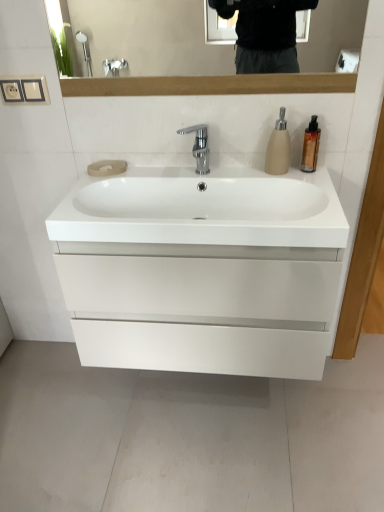
What do you see at coordinates (311, 146) in the screenshot? This screenshot has width=384, height=512. I see `gold metallic soap dispenser at upper right, which is the first soap dispenser from right to left` at bounding box center [311, 146].

This screenshot has height=512, width=384. Find the location of `white glossy sink at center`. white glossy sink at center is located at coordinates (202, 214).

This screenshot has width=384, height=512. What do you see at coordinates (202, 214) in the screenshot? I see `white glossy sink at center` at bounding box center [202, 214].

In the scene shown: What is the approximate height of white glossy cabinet at center?

20.25 inches.

Identify the location of gold metallic soap dispenser at upper right, which appears as the 2th soap dispenser when viewed from the left. This screenshot has width=384, height=512. (311, 146).

At what (x,y) coordinates should I click in order to perform the action: click on soap dispenser located behind the matte beige soap dispenser at upper right, arranged as the second soap dispenser when viewed from the right. Please return your answer as a coordinate pair (x, y). The height and width of the screenshot is (512, 384). Looking at the image, I should click on (311, 146).

Considering the positions of objects matte beige soap dispenser at upper right, arranged as the second soap dispenser when viewed from the right, and gold metallic soap dispenser at upper right, which appears as the 2th soap dispenser when viewed from the left, in the image provided, who is in front, matte beige soap dispenser at upper right, arranged as the second soap dispenser when viewed from the right, or gold metallic soap dispenser at upper right, which appears as the 2th soap dispenser when viewed from the left,?

Positioned in front is matte beige soap dispenser at upper right, arranged as the second soap dispenser when viewed from the right.

Which object is positioned more to the left, matte beige soap dispenser at upper right, arranged as the second soap dispenser when viewed from the right, or gold metallic soap dispenser at upper right, which is the first soap dispenser from right to left?

From the viewer's perspective, matte beige soap dispenser at upper right, arranged as the second soap dispenser when viewed from the right, appears more on the left side.

Is the surface of matte beige soap dispenser at upper right, arranged as the second soap dispenser when viewed from the right, in direct contact with gold metallic soap dispenser at upper right, which appears as the 2th soap dispenser when viewed from the left?

Yes, matte beige soap dispenser at upper right, arranged as the second soap dispenser when viewed from the right, is beside gold metallic soap dispenser at upper right, which appears as the 2th soap dispenser when viewed from the left.

Is point (316, 159) closer to camera compared to point (148, 356)?

Yes, point (316, 159) is closer to viewer.

Where is `the 2nd soap dispenser to the right when counting from the white glossy cabinet at center`? the 2nd soap dispenser to the right when counting from the white glossy cabinet at center is located at coordinates click(311, 146).

Who is taller, gold metallic soap dispenser at upper right, which appears as the 2th soap dispenser when viewed from the left, or white glossy cabinet at center?

With more height is white glossy cabinet at center.

Consider the image. Considering the relative positions of gold metallic soap dispenser at upper right, which appears as the 2th soap dispenser when viewed from the left, and white glossy cabinet at center in the image provided, is gold metallic soap dispenser at upper right, which appears as the 2th soap dispenser when viewed from the left, to the left of white glossy cabinet at center from the viewer's perspective?

In fact, gold metallic soap dispenser at upper right, which appears as the 2th soap dispenser when viewed from the left, is to the right of white glossy cabinet at center.

In terms of width, does gold metallic soap dispenser at upper right, which is the first soap dispenser from right to left, look wider or thinner when compared to polished chrome faucet at center?

In the image, gold metallic soap dispenser at upper right, which is the first soap dispenser from right to left, appears to be more narrow than polished chrome faucet at center.

From the picture: From a real-world perspective, is gold metallic soap dispenser at upper right, which is the first soap dispenser from right to left, located higher than polished chrome faucet at center?

Yes, from a real-world perspective, gold metallic soap dispenser at upper right, which is the first soap dispenser from right to left, is above polished chrome faucet at center.

The height and width of the screenshot is (512, 384). I want to click on the 1st soap dispenser above the polished chrome faucet at center (from the image's perspective), so click(x=311, y=146).

Between point (316, 138) and point (206, 172), which one is positioned behind?

The point (206, 172) is more distant.

Would you say polished chrome faucet at center is a long distance from white glossy sink at center?

polished chrome faucet at center is near white glossy sink at center, not far away.

From the image's perspective, which one is positioned higher, polished chrome faucet at center or white glossy sink at center?

polished chrome faucet at center, from the image's perspective.

In the scene shown: Measure the distance from polished chrome faucet at center to white glossy sink at center.

polished chrome faucet at center and white glossy sink at center are 11.62 inches apart.

In terms of height, does polished chrome faucet at center look taller or shorter compared to white glossy sink at center?

polished chrome faucet at center is taller than white glossy sink at center.

From a real-world perspective, is gold metallic soap dispenser at upper right, which is the first soap dispenser from right to left, physically below matte beige soap dispenser at upper right, which ranks as the 1th soap dispenser in left-to-right order?

Yes, from a real-world perspective, gold metallic soap dispenser at upper right, which is the first soap dispenser from right to left, is beneath matte beige soap dispenser at upper right, which ranks as the 1th soap dispenser in left-to-right order.

How different are the orientations of gold metallic soap dispenser at upper right, which is the first soap dispenser from right to left, and matte beige soap dispenser at upper right, arranged as the second soap dispenser when viewed from the right, in degrees?

6.89e-05 degrees separate the facing orientations of gold metallic soap dispenser at upper right, which is the first soap dispenser from right to left, and matte beige soap dispenser at upper right, arranged as the second soap dispenser when viewed from the right.

Considering the relative positions of gold metallic soap dispenser at upper right, which is the first soap dispenser from right to left, and matte beige soap dispenser at upper right, arranged as the second soap dispenser when viewed from the right, in the image provided, is gold metallic soap dispenser at upper right, which is the first soap dispenser from right to left, in front of matte beige soap dispenser at upper right, arranged as the second soap dispenser when viewed from the right,?

No, gold metallic soap dispenser at upper right, which is the first soap dispenser from right to left, is further to the viewer.

Looking at this image, can you confirm if gold metallic soap dispenser at upper right, which appears as the 2th soap dispenser when viewed from the left, is positioned to the right of matte beige soap dispenser at upper right, which ranks as the 1th soap dispenser in left-to-right order?

Indeed, gold metallic soap dispenser at upper right, which appears as the 2th soap dispenser when viewed from the left, is positioned on the right side of matte beige soap dispenser at upper right, which ranks as the 1th soap dispenser in left-to-right order.

Considering the sizes of objects white glossy cabinet at center and polished chrome faucet at center in the image provided, who is smaller, white glossy cabinet at center or polished chrome faucet at center?

With smaller size is polished chrome faucet at center.

Does point (270, 205) come behind point (201, 150)?

No, (270, 205) is closer to viewer.

Based on their positions, is white glossy cabinet at center located to the left or right of polished chrome faucet at center?

white glossy cabinet at center is positioned on polished chrome faucet at center's right side.

Considering the relative sizes of gold metallic soap dispenser at upper right, which is the first soap dispenser from right to left, and white glossy sink at center in the image provided, is gold metallic soap dispenser at upper right, which is the first soap dispenser from right to left, taller than white glossy sink at center?

Yes, gold metallic soap dispenser at upper right, which is the first soap dispenser from right to left, is taller than white glossy sink at center.

Is white glossy sink at center inside gold metallic soap dispenser at upper right, which is the first soap dispenser from right to left?

That's incorrect, white glossy sink at center is not inside gold metallic soap dispenser at upper right, which is the first soap dispenser from right to left.

The image size is (384, 512). Find the location of `the 2nd soap dispenser behind the white glossy sink at center, starting your count from the anchor`. the 2nd soap dispenser behind the white glossy sink at center, starting your count from the anchor is located at coordinates (311, 146).

Where is `soap dispenser that appears behind the matte beige soap dispenser at upper right, which ranks as the 1th soap dispenser in left-to-right order`? This screenshot has height=512, width=384. soap dispenser that appears behind the matte beige soap dispenser at upper right, which ranks as the 1th soap dispenser in left-to-right order is located at coordinates (311, 146).

The height and width of the screenshot is (512, 384). There is a white glossy cabinet at center. What are the coordinates of `the 1st soap dispenser above it (from a real-world perspective)` in the screenshot? It's located at (311, 146).

From the image, which object appears to be farther from gold metallic soap dispenser at upper right, which is the first soap dispenser from right to left, polished chrome faucet at center or white glossy cabinet at center?

Based on the image, white glossy cabinet at center appears to be further to gold metallic soap dispenser at upper right, which is the first soap dispenser from right to left.

In the scene shown: Based on their spatial positions, is white glossy cabinet at center or polished chrome faucet at center further from white glossy sink at center?

polished chrome faucet at center is further to white glossy sink at center.

Looking at the image, which one is located closer to white glossy cabinet at center, gold metallic soap dispenser at upper right, which appears as the 2th soap dispenser when viewed from the left, or white glossy sink at center?

white glossy sink at center lies closer to white glossy cabinet at center than the other object.

In the scene shown: Which object lies nearer to the anchor point polished chrome faucet at center, white glossy sink at center or matte beige soap dispenser at upper right, arranged as the second soap dispenser when viewed from the right?

Among the two, matte beige soap dispenser at upper right, arranged as the second soap dispenser when viewed from the right, is located nearer to polished chrome faucet at center.

Considering their positions, is white glossy cabinet at center positioned closer to polished chrome faucet at center than white glossy sink at center?

white glossy sink at center is closer to polished chrome faucet at center.

Estimate the real-world distances between objects in this image. Which object is closer to polished chrome faucet at center, matte beige soap dispenser at upper right, which ranks as the 1th soap dispenser in left-to-right order, or white glossy sink at center?

matte beige soap dispenser at upper right, which ranks as the 1th soap dispenser in left-to-right order, lies closer to polished chrome faucet at center than the other object.

Which object lies nearer to the anchor point matte beige soap dispenser at upper right, arranged as the second soap dispenser when viewed from the right, white glossy cabinet at center or white glossy sink at center?

white glossy sink at center lies closer to matte beige soap dispenser at upper right, arranged as the second soap dispenser when viewed from the right, than the other object.

Looking at the image, which one is located further to gold metallic soap dispenser at upper right, which appears as the 2th soap dispenser when viewed from the left, white glossy cabinet at center or white glossy sink at center?

Among the two, white glossy cabinet at center is located further to gold metallic soap dispenser at upper right, which appears as the 2th soap dispenser when viewed from the left.

The height and width of the screenshot is (512, 384). Identify the location of sink between gold metallic soap dispenser at upper right, which appears as the 2th soap dispenser when viewed from the left, and white glossy cabinet at center from top to bottom. (202, 214).

Image resolution: width=384 pixels, height=512 pixels. In order to click on sink between polished chrome faucet at center and matte beige soap dispenser at upper right, arranged as the second soap dispenser when viewed from the right, in the horizontal direction in this screenshot , I will do `click(202, 214)`.

This screenshot has height=512, width=384. I want to click on sink located between polished chrome faucet at center and gold metallic soap dispenser at upper right, which appears as the 2th soap dispenser when viewed from the left, in the left-right direction, so click(202, 214).

You are a GUI agent. You are given a task and a screenshot of the screen. Output one action in this format:
    pyautogui.click(x=<x>, y=<y>)
    Task: Click on the tap between matte beige soap dispenser at upper right, arranged as the second soap dispenser when viewed from the right, and white glossy cabinet at center vertically
    This screenshot has width=384, height=512.
    Given the screenshot: What is the action you would take?
    pyautogui.click(x=199, y=147)